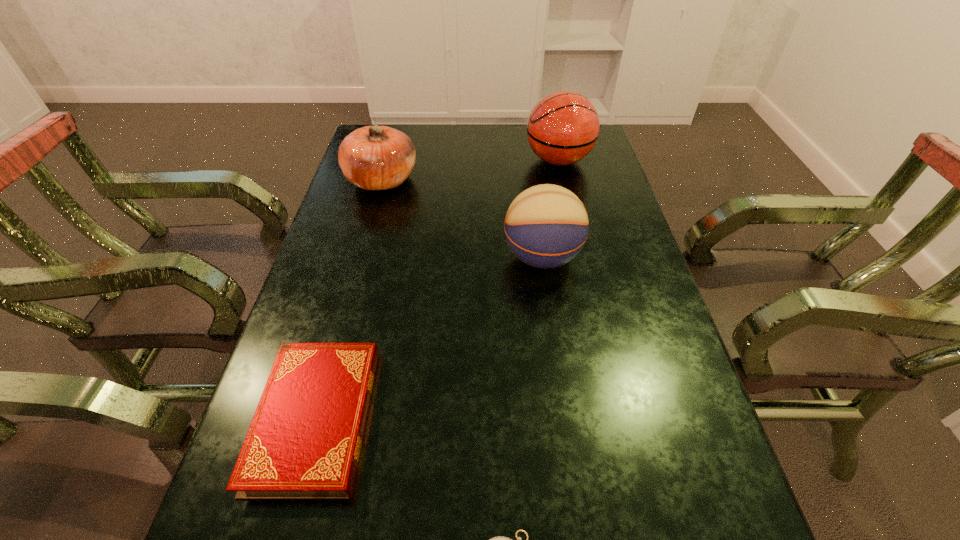
Where is `vacant position located 0.380m on the patterned surface of the third nearest object`? The width and height of the screenshot is (960, 540). vacant position located 0.380m on the patterned surface of the third nearest object is located at coordinates [x=355, y=257].

Identify the location of vacant area situated on the front of the third shortest object. (368, 231).

Where is `basketball that is at the far edge`? Image resolution: width=960 pixels, height=540 pixels. basketball that is at the far edge is located at coordinates (563, 127).

In order to click on pumpkin positioned at the far edge in this screenshot , I will do `click(375, 157)`.

Locate an element on the screen. Image resolution: width=960 pixels, height=540 pixels. pumpkin that is at the left edge is located at coordinates (375, 157).

The image size is (960, 540). Find the location of `hardback book located in the left edge section of the desktop`. hardback book located in the left edge section of the desktop is located at coordinates (304, 442).

Locate an element on the screen. This screenshot has height=540, width=960. object that is at the far left corner is located at coordinates (375, 157).

Identify the location of object that is at the far right corner. The height and width of the screenshot is (540, 960). (563, 127).

This screenshot has height=540, width=960. Identify the location of vacant space at the far edge. (458, 148).

Identify the location of vacant space at the left edge of the desktop. (372, 245).